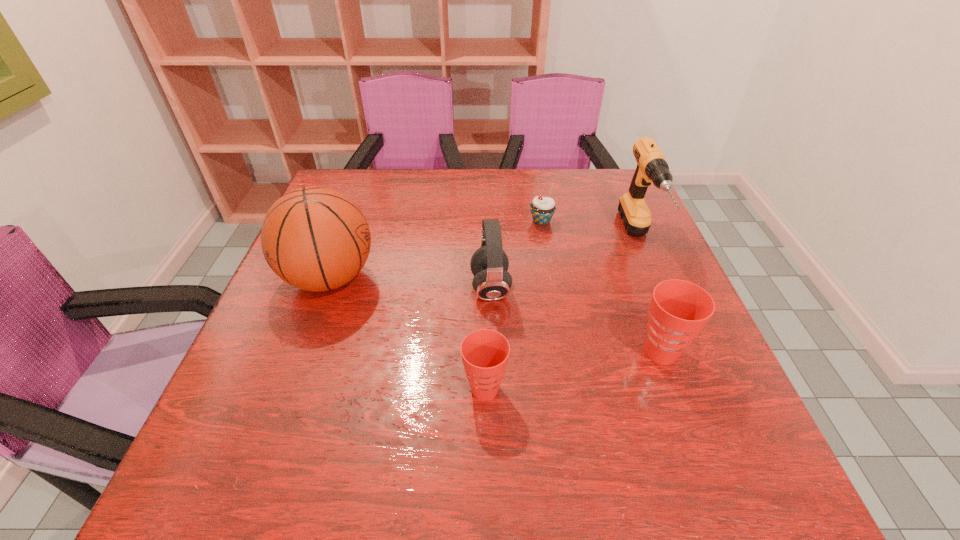
Find the location of a particular element. The image size is (960, 540). drill located in the right edge section of the desktop is located at coordinates (652, 167).

Find the location of a particular element. object positioned at the far right corner is located at coordinates (652, 167).

Where is `vacant region at the far edge`? The image size is (960, 540). vacant region at the far edge is located at coordinates (418, 198).

The image size is (960, 540). In the image, there is a desktop. Find the location of `vacant space at the near edge`. vacant space at the near edge is located at coordinates (612, 402).

In order to click on vacant area at the left edge of the desktop in this screenshot , I will do `click(337, 320)`.

Identify the location of free spot at the right edge of the desktop. (612, 257).

In the image, there is a desktop. At what (x,y) coordinates should I click in order to perform the action: click on vacant space at the far left corner. Please return your answer as a coordinate pair (x, y). The width and height of the screenshot is (960, 540). Looking at the image, I should click on (345, 194).

At what (x,y) coordinates should I click in order to perform the action: click on free spot between the drill and the headset. Please return your answer as a coordinate pair (x, y). The width and height of the screenshot is (960, 540). Looking at the image, I should click on (564, 264).

Where is `free area in between the cupcake and the headset`? This screenshot has width=960, height=540. free area in between the cupcake and the headset is located at coordinates (516, 254).

Where is `free space between the headset and the taller cup`? This screenshot has width=960, height=540. free space between the headset and the taller cup is located at coordinates (576, 320).